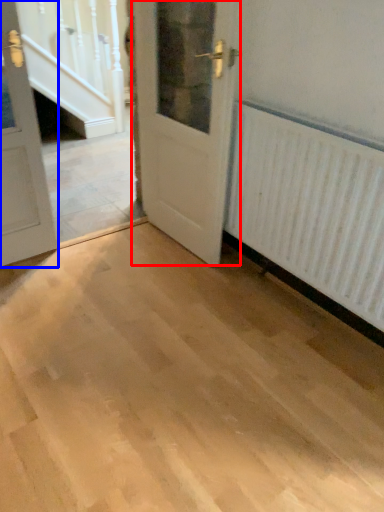
Question: Which object appears closest to the camera in this image, door (highlighted by a red box) or door (highlighted by a blue box)?

Choices:
 (A) door
 (B) door

Answer: (B)